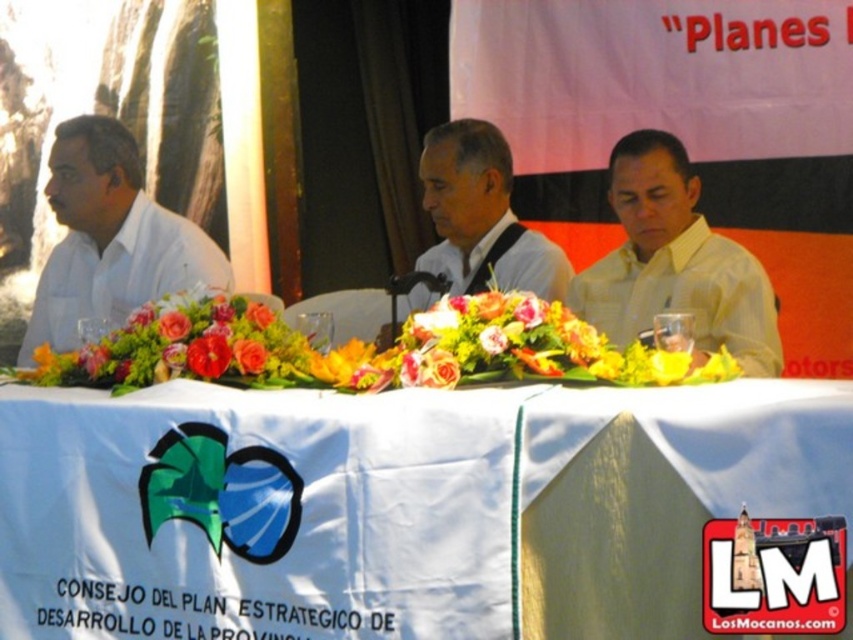
You are a photographer setting up for the event. You need to ensure that the white cloth at center and the white matte shirt at center are both visible in the frame. Based on their positions, which object is wider and therefore requires more space in the composition?

The white cloth at center is wider than the white matte shirt at center, so it requires more space in the composition to ensure both are fully visible.

You are attending a formal event and notice two white items on the stage. One is the white cloth at center and the other is the white matte shirt at left. From your perspective, which item is located to the right of the other?

The white cloth at center is positioned on the right side of the white matte shirt at left, so from your perspective, the white cloth at center is to the right of the white matte shirt at left.